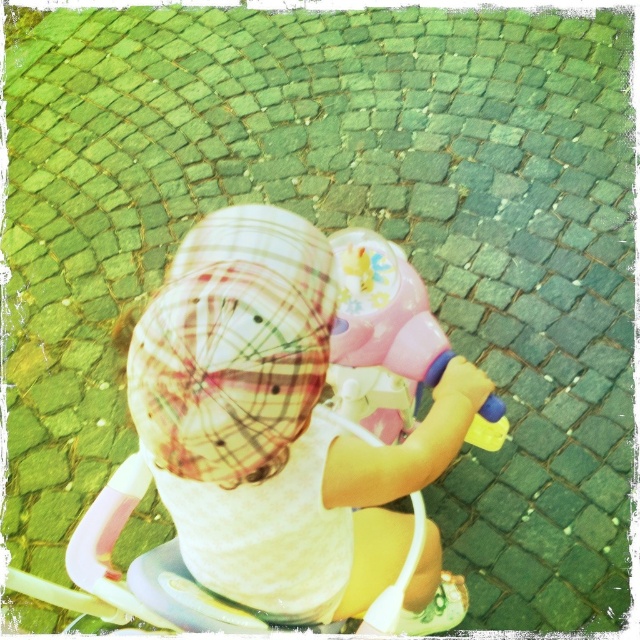
You are a photographer trying to capture a closeup of the white plaid hat at center and the pink plastic toy at center. Which object should you focus on first to ensure both are in focus?

The white plaid hat at center is closer to the viewer than the pink plastic toy at center, so you should focus on the white plaid hat at center first to ensure both are in focus.

You are a photographer trying to capture a closeup of the white plaid hat at center and the pink plastic toy at center. Which object should you zoom in on to ensure both fit in the frame without cropping?

The white plaid hat at center is wider than the pink plastic toy at center, so you should zoom out slightly to ensure both fit in the frame without cropping.